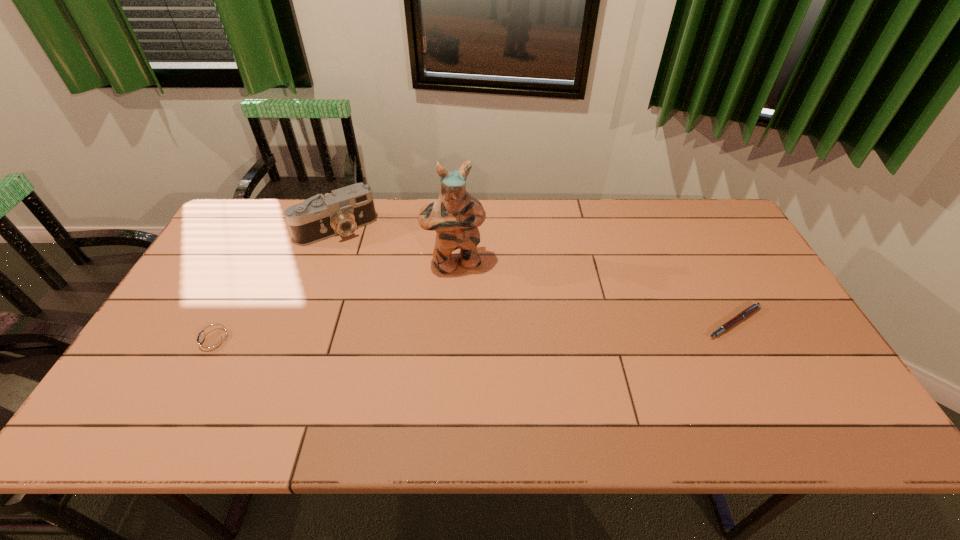
Identify the location of free spot on the desktop that is between the watch and the rightmost object and is positioned on the lens of the third shortest object. (401, 335).

Find the location of `vacant space on the desktop that is between the third tallest object and the shortest object and is positioned on the front-facing side of the second farthest object`. vacant space on the desktop that is between the third tallest object and the shortest object and is positioned on the front-facing side of the second farthest object is located at coordinates (479, 332).